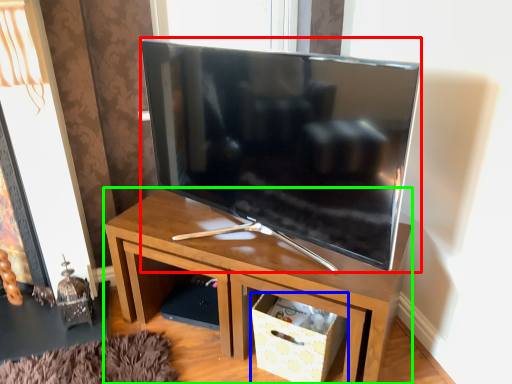
Question: Which is farther away from television (highlighted by a red box)? storage box (highlighted by a blue box) or desk (highlighted by a green box)?

Choices:
 (A) storage box
 (B) desk

Answer: (A)